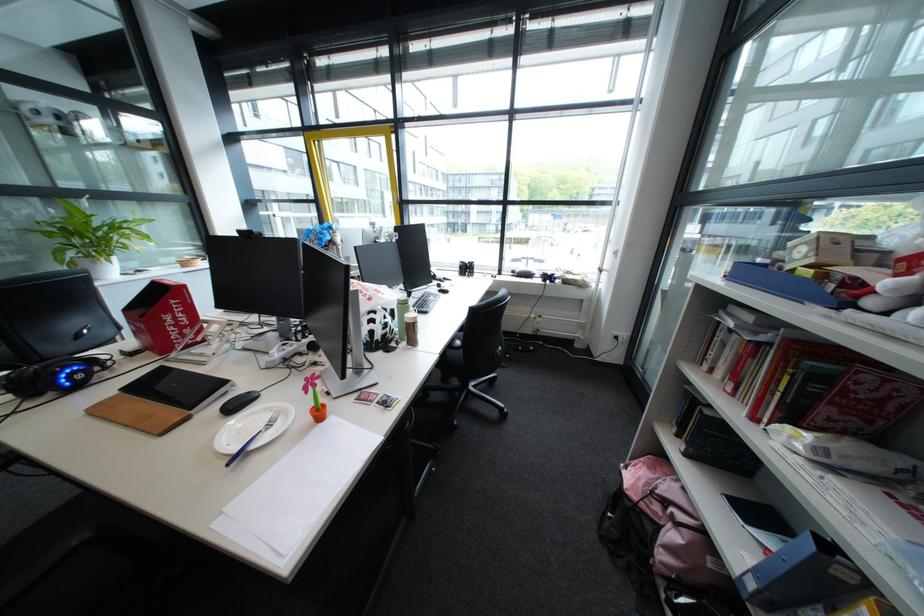
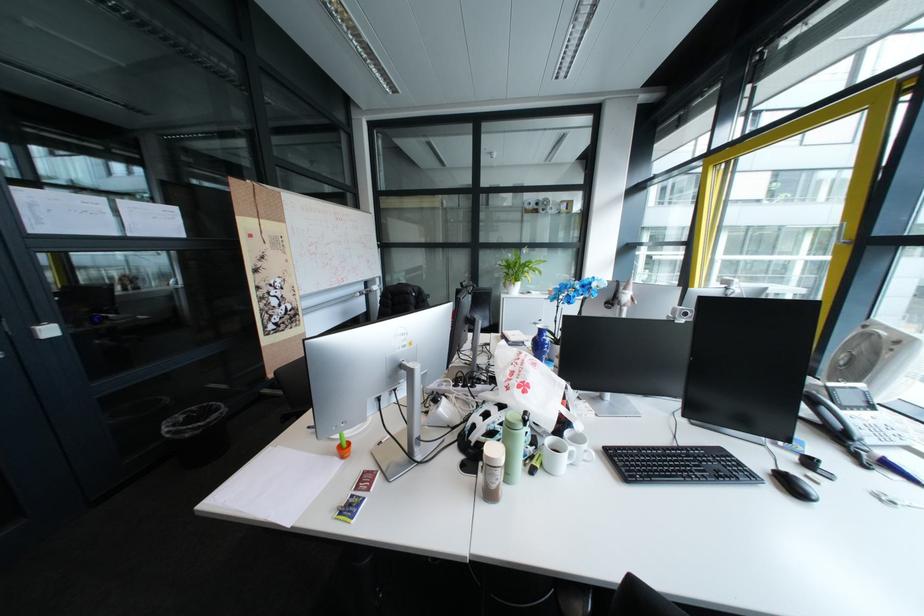
Where in the second image is the point corresponding to (388,323) from the first image?

(497, 421)